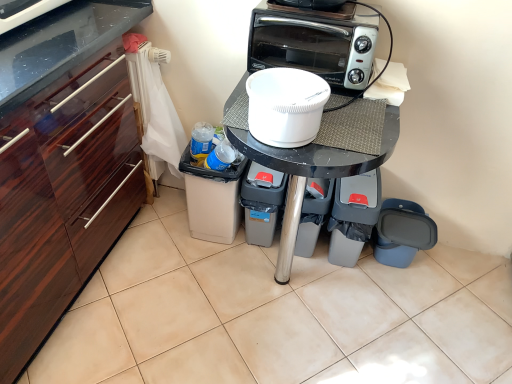
Locate an element on the screen. The height and width of the screenshot is (384, 512). unoccupied area in front of gray plastic trash can at lower center, positioned as the 2th appliance in left-to-right order is located at coordinates (305, 279).